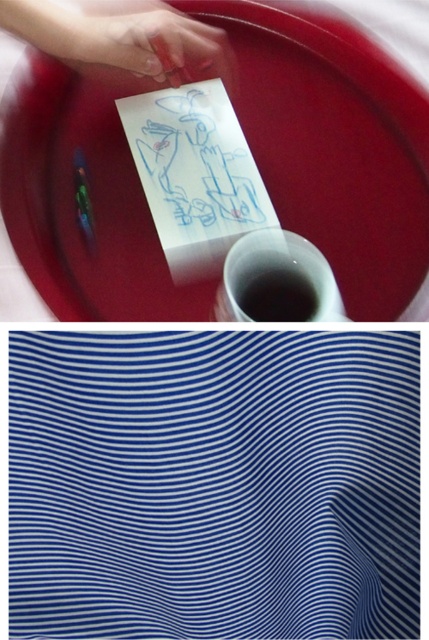
You are a robot trying to avoid touching the smooth skin hand at upper left. What coordinates should you move to in order to stay clear of it?

The smooth skin hand at upper left is located at coordinates point (163,49), so moving to any coordinates outside this point would keep you clear of it.

You are a teacher observing an experiment in a classroom. You notice a smooth skin hand at upper left holding a paper in a black matte liquid at center. Can the hand fully submerge the paper into the liquid without spilling any?

Answer: The smooth skin hand at upper left has a larger size compared to black matte liquid at center, so yes, the hand can fully submerge the paper into the liquid without spilling any.